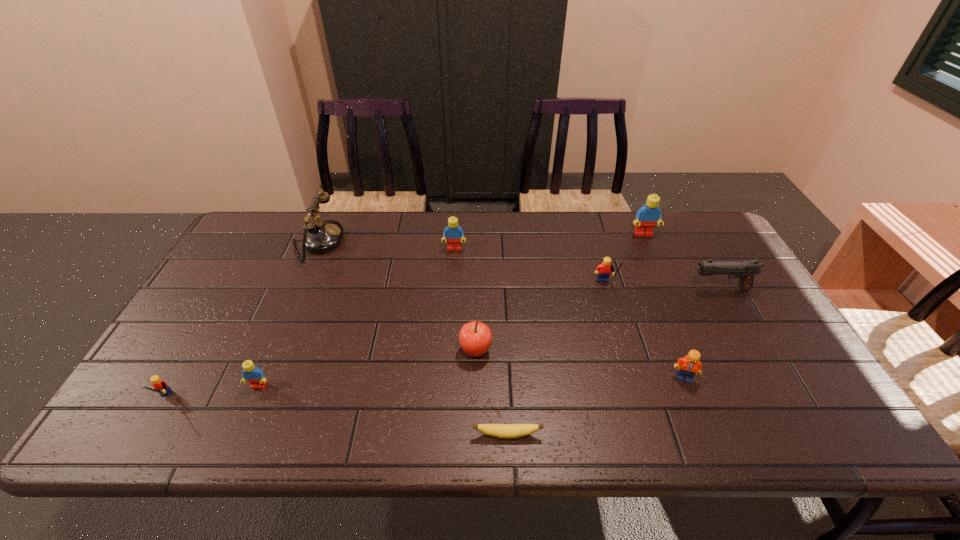
Image resolution: width=960 pixels, height=540 pixels. What are the coordinates of `vacant area located on the face of the second biggest blue Lego` in the screenshot? It's located at (453, 271).

Find the location of `vacant area situated 0.360m on the front-facing side of the bigger yellow Lego`. vacant area situated 0.360m on the front-facing side of the bigger yellow Lego is located at coordinates point(640,406).

Where is `free space located in the direction the gray gun is aimed`? free space located in the direction the gray gun is aimed is located at coordinates (669, 289).

This screenshot has height=540, width=960. Identify the location of free space located 0.350m in the direction the gray gun is aimed. (569, 289).

Locate an element on the screen. vacant point located 0.330m in the direction the gray gun is aimed is located at coordinates 576,289.

Where is `free spot located 0.080m on the front of the pink apple`? free spot located 0.080m on the front of the pink apple is located at coordinates (475, 393).

The image size is (960, 540). Find the location of `vacant region located 0.070m on the front-facing side of the orange Lego`. vacant region located 0.070m on the front-facing side of the orange Lego is located at coordinates (696, 410).

Where is `vacant space located 0.110m on the face of the nearest blue Lego`? The width and height of the screenshot is (960, 540). vacant space located 0.110m on the face of the nearest blue Lego is located at coordinates (238, 435).

Where is `vacant space situated 0.200m on the left of the nearest object`? vacant space situated 0.200m on the left of the nearest object is located at coordinates tap(380, 435).

Where is `telephone at the far edge`? The height and width of the screenshot is (540, 960). telephone at the far edge is located at coordinates (323, 236).